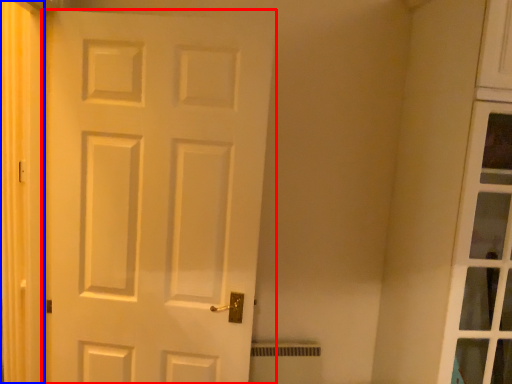
Question: Which of the following is the closest to the observer, door (highlighted by a red box) or curtain (highlighted by a blue box)?

Choices:
 (A) door
 (B) curtain

Answer: (B)